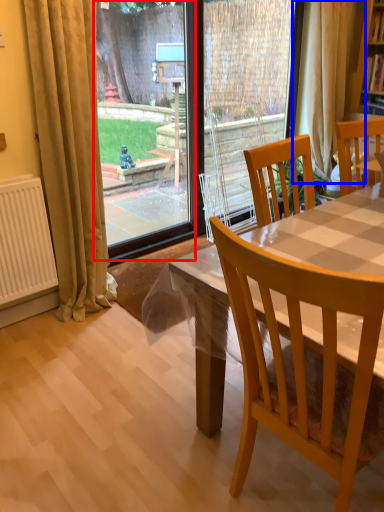
Question: Which object appears farthest to the camera in this image, glass door (highlighted by a red box) or curtain (highlighted by a blue box)?

Choices:
 (A) glass door
 (B) curtain

Answer: (B)